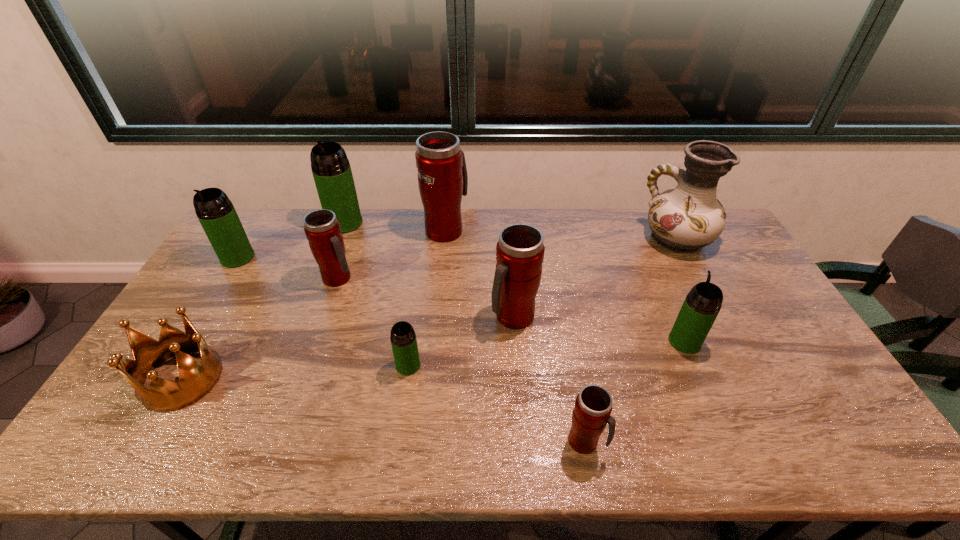
Locate an element on the screen. object that stands as the fourth closest to the biggest red thermos bottle is located at coordinates (403, 339).

I want to click on thermos bottle that is the sixth closest to the second green thermos bottle from left to right, so click(593, 406).

Identify which thermos bottle is the closest to the third red thermos bottle from left to right. Please provide its 2D coordinates. Your answer should be formatted as a tuple, i.e. [(x, y)], where the tuple contains the x and y coordinates of a point satisfying the conditions above.

[(403, 339)]

Identify which green thermos bottle is located as the third nearest to the leftmost green thermos bottle. Please provide its 2D coordinates. Your answer should be formatted as a tuple, i.e. [(x, y)], where the tuple contains the x and y coordinates of a point satisfying the conditions above.

[(702, 304)]

Select which green thermos bottle appears as the second closest to the biggest red thermos bottle. Please provide its 2D coordinates. Your answer should be formatted as a tuple, i.e. [(x, y)], where the tuple contains the x and y coordinates of a point satisfying the conditions above.

[(403, 339)]

Locate which red thermos bottle is the closest to the second nearest red thermos bottle. Please provide its 2D coordinates. Your answer should be formatted as a tuple, i.e. [(x, y)], where the tuple contains the x and y coordinates of a point satisfying the conditions above.

[(593, 406)]

Identify which red thermos bottle is located as the third nearest to the second green thermos bottle from left to right. Please provide its 2D coordinates. Your answer should be formatted as a tuple, i.e. [(x, y)], where the tuple contains the x and y coordinates of a point satisfying the conditions above.

[(520, 250)]

The image size is (960, 540). I want to click on vacant area in the image that satisfies the following two spatial constraints: 1. from the spout of the third biggest green thermos bottle; 2. on the side with the handle of the third nearest red thermos bottle, so click(x=658, y=279).